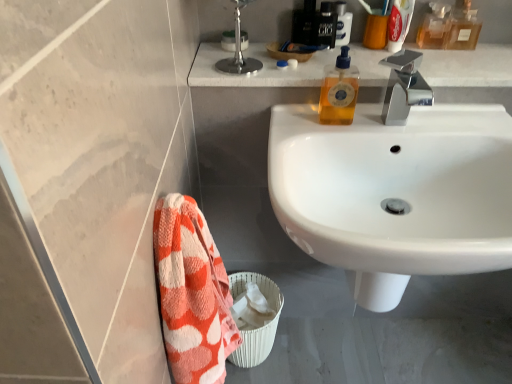
Question: From the image's perspective, is shiny black bottle at upper center, which appears as the second toiletry when viewed from the top, located above white plastic toothpaste tube at upper right, the third mouthwash in the right-to-left sequence?

Choices:
 (A) no
 (B) yes

Answer: (A)

Question: Can you confirm if shiny black bottle at upper center, the 2th toiletry in the back-to-front sequence, is thinner than white plastic toothpaste tube at upper right, marked as the 2th mouthwash in a left-to-right arrangement?

Choices:
 (A) no
 (B) yes

Answer: (A)

Question: Is white plastic toothpaste tube at upper right, marked as the 2th mouthwash in a left-to-right arrangement, at the back of shiny black bottle at upper center, the 2th toiletry in the back-to-front sequence?

Choices:
 (A) no
 (B) yes

Answer: (A)

Question: Is shiny black bottle at upper center, the second toiletry in the bottom-to-top sequence, in contact with white plastic toothpaste tube at upper right, marked as the 2th mouthwash in a left-to-right arrangement?

Choices:
 (A) yes
 (B) no

Answer: (B)

Question: From the image's perspective, is shiny black bottle at upper center, the 2th toiletry in the back-to-front sequence, beneath white plastic toothpaste tube at upper right, marked as the 2th mouthwash in a left-to-right arrangement?

Choices:
 (A) no
 (B) yes

Answer: (B)

Question: From the image's perspective, is translucent plastic mouthwash at upper center, marked as the 1th mouthwash in a left-to-right arrangement, above or below white woven basket at lower center?

Choices:
 (A) below
 (B) above

Answer: (B)

Question: From a real-world perspective, relative to white woven basket at lower center, is translucent plastic mouthwash at upper center, the 4th mouthwash positioned from the right, vertically above or below?

Choices:
 (A) below
 (B) above

Answer: (B)

Question: Based on their positions, is translucent plastic mouthwash at upper center, the 4th mouthwash positioned from the right, located to the left or right of white woven basket at lower center?

Choices:
 (A) right
 (B) left

Answer: (A)

Question: Looking at their shapes, would you say translucent plastic mouthwash at upper center, marked as the 1th mouthwash in a left-to-right arrangement, is wider or thinner than white woven basket at lower center?

Choices:
 (A) thin
 (B) wide

Answer: (A)

Question: Is white glossy sink at center in front of or behind orange cotton towel at lower left in the image?

Choices:
 (A) behind
 (B) front

Answer: (A)

Question: Considering the positions of point (348, 215) and point (179, 332), is point (348, 215) closer or farther from the camera than point (179, 332)?

Choices:
 (A) closer
 (B) farther

Answer: (B)

Question: In terms of height, does white glossy sink at center look taller or shorter compared to orange cotton towel at lower left?

Choices:
 (A) short
 (B) tall

Answer: (B)

Question: Looking at the image, does white glossy sink at center seem bigger or smaller compared to orange cotton towel at lower left?

Choices:
 (A) big
 (B) small

Answer: (A)

Question: Is polished chrome faucet at upper right situated inside translucent amber liquid at upper right, which is the 2th mouthwash from right to left, or outside?

Choices:
 (A) inside
 (B) outside

Answer: (B)

Question: Is point (237, 67) closer or farther from the camera than point (436, 28)?

Choices:
 (A) farther
 (B) closer

Answer: (B)